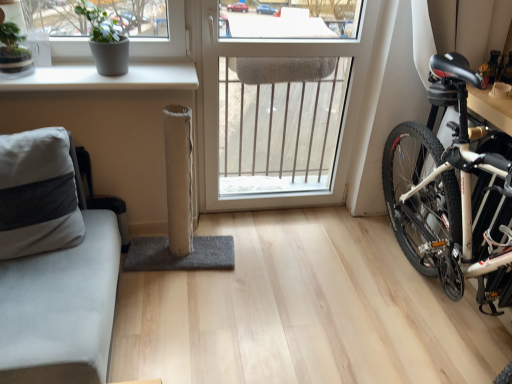
This screenshot has height=384, width=512. Find the location of `vacant region to the left of gray matte pot at upper left`. vacant region to the left of gray matte pot at upper left is located at coordinates (65, 74).